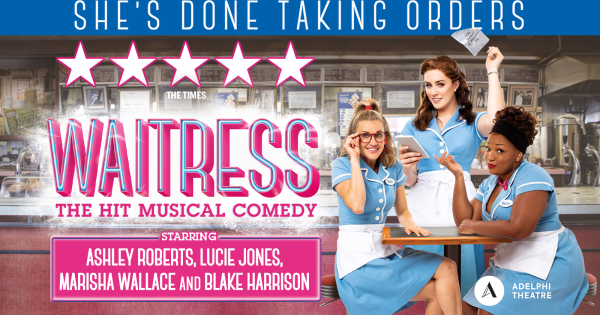
Identify the location of framed pictures. This screenshot has height=315, width=600. (104, 96), (72, 98), (241, 96), (301, 98), (353, 95), (397, 95), (482, 94), (526, 97).